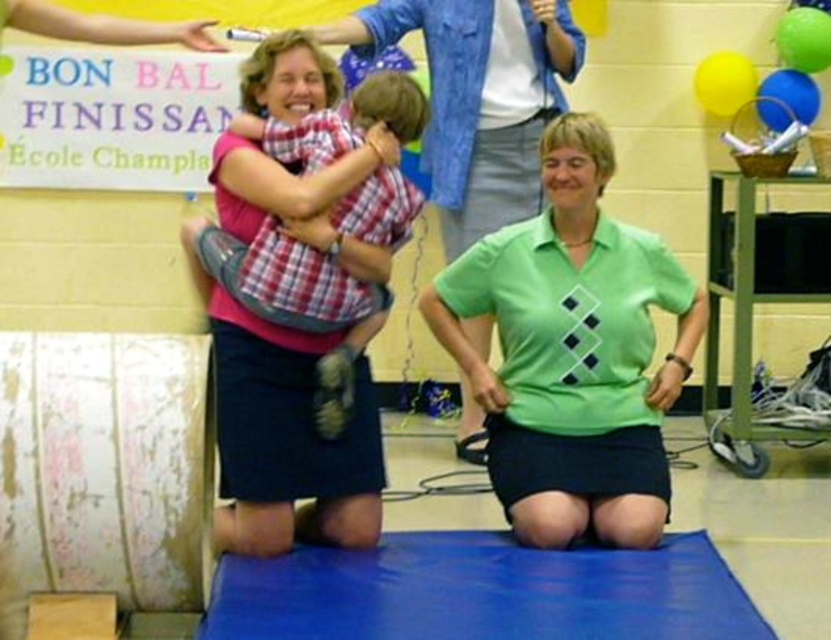
In the scene shown: You are a photographer trying to capture a photo of the green argyle polo shirt at center and the blue fabric yoga mat at center. Which object should you focus on first if you want to ensure both are in focus, considering their sizes?

The green argyle polo shirt at center is much taller than the blue fabric yoga mat at center, so you should focus on the green argyle polo shirt at center first to ensure both are in focus.

You are a photographer standing in front of the scene. You want to take a photo of the blue fabric yoga mat at center without the green argyle polo shirt at center blocking the view. Is this possible?

The green argyle polo shirt at center is further to the viewer than the blue fabric yoga mat at center, so it is blocking the view. Therefore, you cannot take a photo of the blue fabric yoga mat at center without the green argyle polo shirt at center blocking the view.

You are organizing a school event and need to know the arrangement of the clothing items displayed. Which clothing item is placed above the other between the green argyle sweater at center and the plaid fabric shirt at upper left?

The green argyle sweater at center is positioned over the plaid fabric shirt at upper left, meaning it is placed above the plaid fabric shirt at upper left.